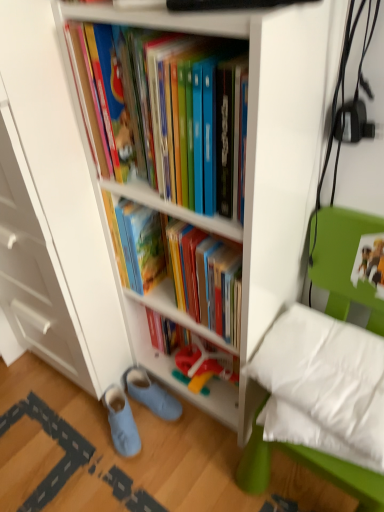
Where is `free location to the right of blue suede slippers at lower left, the 1th footwear positioned from the right`? This screenshot has height=512, width=384. free location to the right of blue suede slippers at lower left, the 1th footwear positioned from the right is located at coordinates (204, 428).